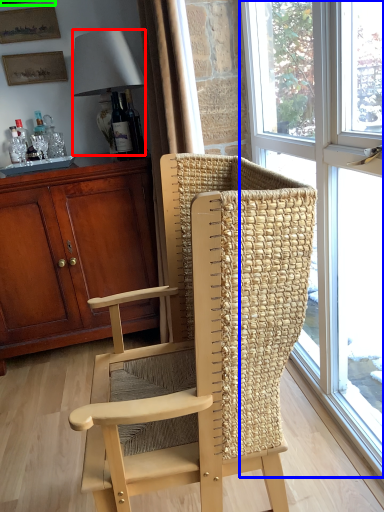
Question: Which object is positioned farthest from lamp (highlighted by a red box)? Select from window (highlighted by a blue box) and picture frame (highlighted by a green box).

Choices:
 (A) window
 (B) picture frame

Answer: (A)